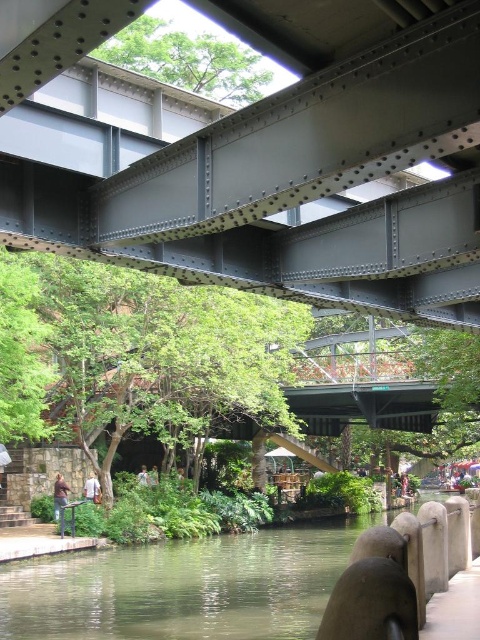
Is gray metallic bridge at upper center smaller than light brown hair at center?

Correct, gray metallic bridge at upper center occupies less space than light brown hair at center.

Who is higher up, gray metallic bridge at upper center or light brown hair at center?

gray metallic bridge at upper center is higher up.

Between point (446, 180) and point (148, 476), which one is positioned behind?

Point (148, 476)

Find the location of `gray metallic bridge at upper center`. gray metallic bridge at upper center is located at coordinates (266, 156).

Can you confirm if green concrete river at lower center is positioned below white cotton shirt at lower left?

Yes.

Measure the distance between green concrete river at lower center and camera.

A distance of 12.54 meters exists between green concrete river at lower center and camera.

Locate an element on the screen. The width and height of the screenshot is (480, 640). green concrete river at lower center is located at coordinates (182, 588).

Which of these two, concrete at lower right or brown leather jacket at lower left, stands shorter?

concrete at lower right

This screenshot has width=480, height=640. What do you see at coordinates (455, 608) in the screenshot? I see `concrete at lower right` at bounding box center [455, 608].

Measure the distance between point (435, 632) and camera.

They are 8.08 meters apart.

At what (x,y) coordinates should I click in order to perform the action: click on concrete at lower right. Please return your answer as a coordinate pair (x, y). This screenshot has width=480, height=640. Looking at the image, I should click on (455, 608).